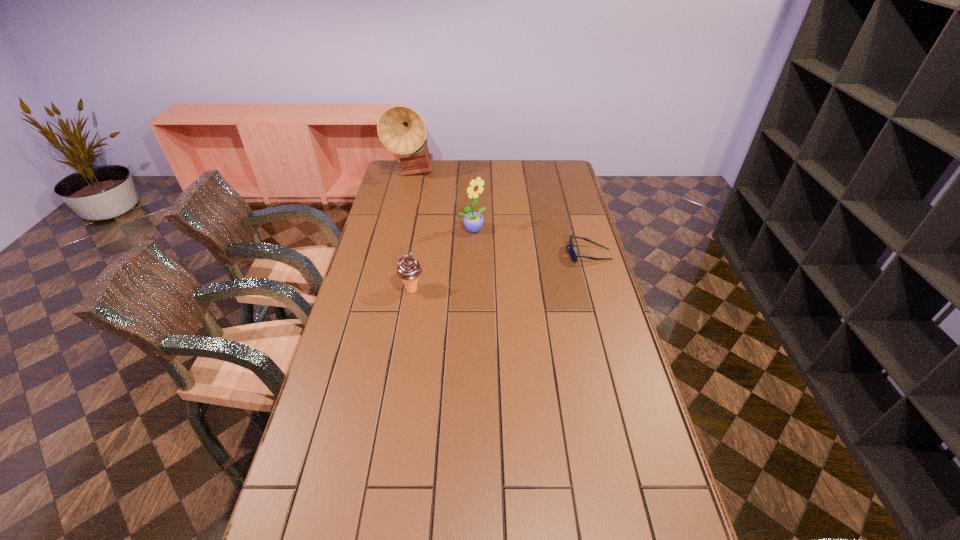
At what (x,y) coordinates should I click in order to perform the action: click on blank area in the image that satisfies the following two spatial constraints: 1. on the front side of the shortest object; 2. on the front-facing side of the farthest object. Please return your answer as a coordinate pair (x, y). The image size is (960, 540). Looking at the image, I should click on click(x=392, y=254).

At what (x,y) coordinates should I click in order to perform the action: click on free space in the image that satisfies the following two spatial constraints: 1. on the back side of the second shortest object; 2. on the left side of the second tallest object. Please return your answer as a coordinate pair (x, y). Looking at the image, I should click on (421, 230).

Find the location of a particular element. This screenshot has width=960, height=540. free location that satisfies the following two spatial constraints: 1. on the front side of the rightmost object; 2. on the front-facing side of the second farthest object is located at coordinates (472, 254).